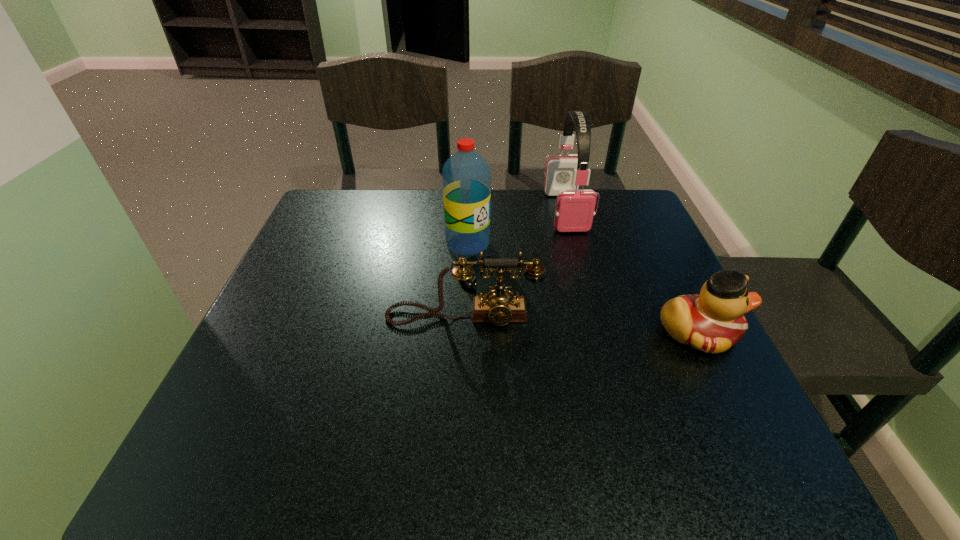
In order to click on vacant space on the desktop that is between the telephone and the duck and is positioned on the front label of the water bottle in this screenshot , I will do `click(545, 322)`.

Locate an element on the screen. vacant space on the desktop that is between the telephone and the duck and is positioned on the outer surface of the earphone is located at coordinates (603, 326).